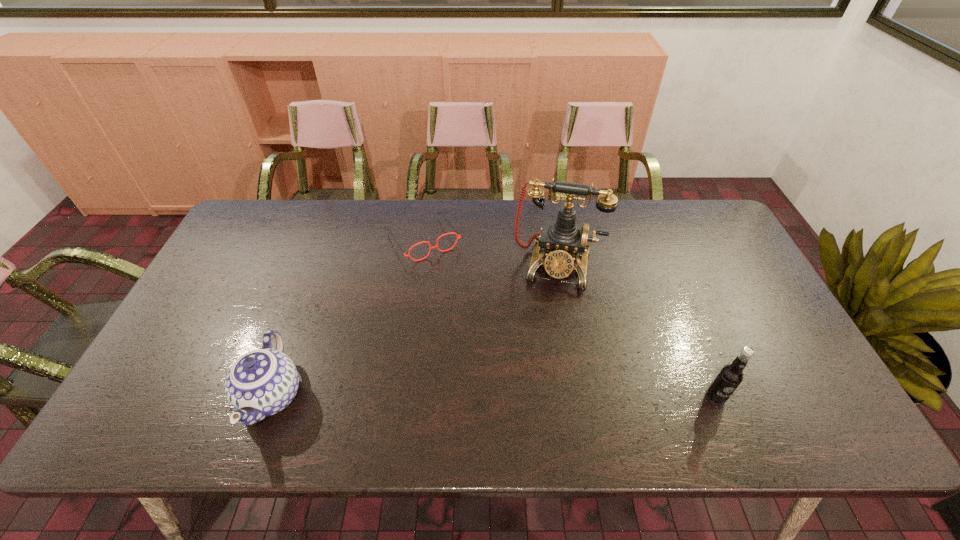
Image resolution: width=960 pixels, height=540 pixels. Identify the location of free spot on the desktop that is between the leftmost object and the root beer and is positioned on the front-facing side of the third object from right to left. (530, 396).

You are a GUI agent. You are given a task and a screenshot of the screen. Output one action in this format:
    pyautogui.click(x=<x>, y=<y>)
    Task: Click on the free space on the desktop that is between the third tallest object and the third shortest object and is positioned on the front of the second object from right to left, featuring the rotary dial
    
    Given the screenshot: What is the action you would take?
    pyautogui.click(x=536, y=396)